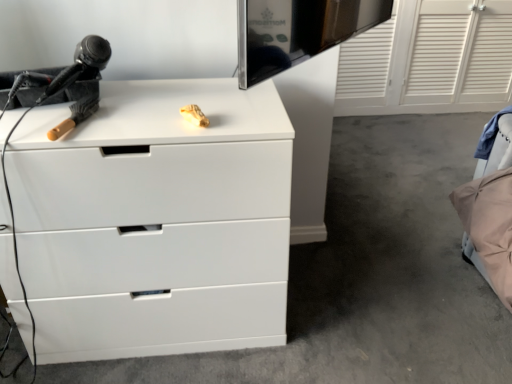
Where is `vacant space that is to the left of beige fabric bed at lower right`? The image size is (512, 384). vacant space that is to the left of beige fabric bed at lower right is located at coordinates (419, 249).